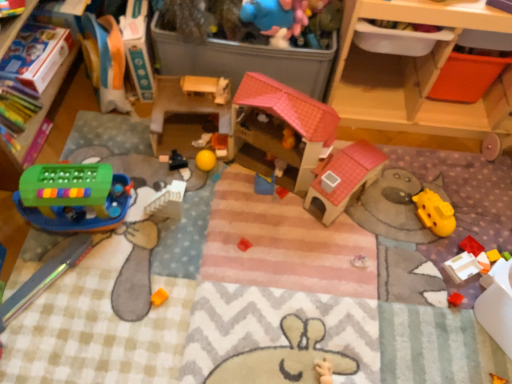
You are a GUI agent. You are given a task and a screenshot of the screen. Output one action in this format:
    pyautogui.click(x=<x>, y=<y>)
    Task: Click on the vacant space in between white matte figurine at center, arranged as the sixth toy when viewed from the right, and white plastic block at lower right, acting as the eighth toy starting from the left
    
    Given the screenshot: What is the action you would take?
    pyautogui.click(x=351, y=220)